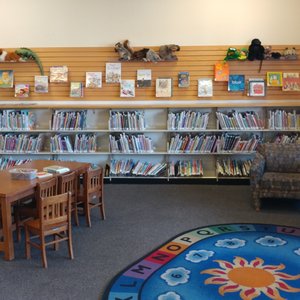
Identify the location of empty space on right side of bookshelf. (156, 119), (95, 122), (44, 121), (47, 147), (104, 143), (159, 141), (207, 168), (213, 125).